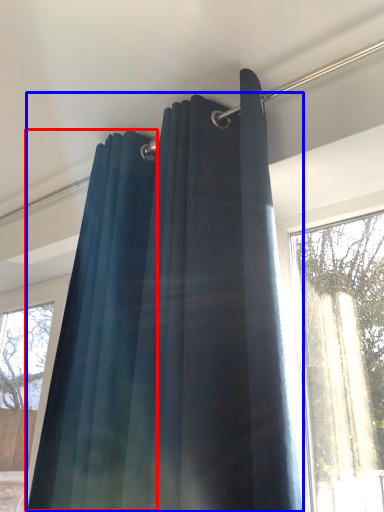
Question: Which of the following is the closest to the observer, shower curtain (highlighted by a red box) or curtain (highlighted by a blue box)?

Choices:
 (A) shower curtain
 (B) curtain

Answer: (B)